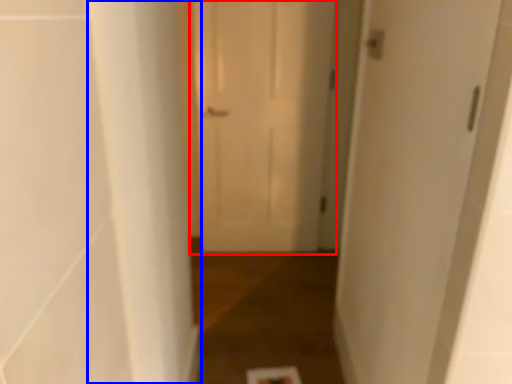
Question: Which object is closer to the camera taking this photo, door (highlighted by a red box) or pillar (highlighted by a blue box)?

Choices:
 (A) door
 (B) pillar

Answer: (B)